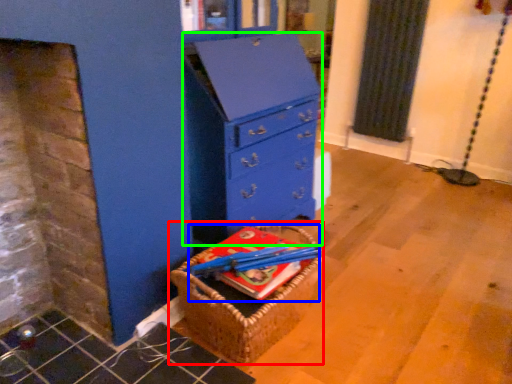
Question: Which is nearer to the basket (highlighted by a red box)? book (highlighted by a blue box) or chest of drawers (highlighted by a green box).

Choices:
 (A) book
 (B) chest of drawers

Answer: (A)